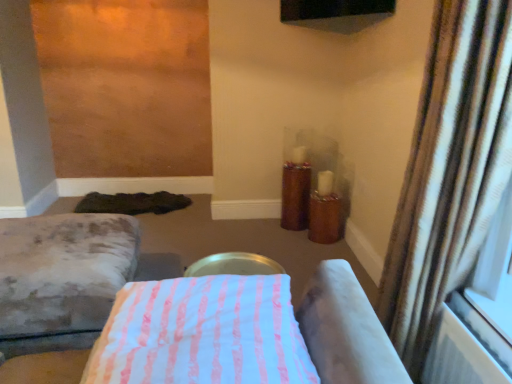
Question: Considering the relative sizes of brown striped curtain at right and pink striped fabric at center, the second furniture when ordered from left to right, in the image provided, is brown striped curtain at right thinner than pink striped fabric at center, the second furniture when ordered from left to right,?

Choices:
 (A) no
 (B) yes

Answer: (B)

Question: Does brown striped curtain at right have a lesser height compared to pink striped fabric at center, the 1th furniture viewed from the front?

Choices:
 (A) no
 (B) yes

Answer: (A)

Question: Is brown striped curtain at right oriented towards pink striped fabric at center, the 1th furniture viewed from the front?

Choices:
 (A) no
 (B) yes

Answer: (A)

Question: Is pink striped fabric at center, which is the first furniture from right to left, at the back of brown striped curtain at right?

Choices:
 (A) no
 (B) yes

Answer: (A)

Question: Does brown striped curtain at right contain pink striped fabric at center, the second furniture when ordered from left to right?

Choices:
 (A) yes
 (B) no

Answer: (B)

Question: From a real-world perspective, is brown striped curtain at right positioned under pink striped fabric at center, the second furniture when ordered from left to right, based on gravity?

Choices:
 (A) yes
 (B) no

Answer: (B)

Question: Could you tell me if wooden candle holder at center-right is facing pink striped fabric at center, the 1th furniture viewed from the front?

Choices:
 (A) no
 (B) yes

Answer: (B)

Question: Considering the relative sizes of wooden candle holder at center-right and pink striped fabric at center, which is the first furniture from right to left, in the image provided, is wooden candle holder at center-right shorter than pink striped fabric at center, which is the first furniture from right to left,?

Choices:
 (A) no
 (B) yes

Answer: (A)

Question: Considering the relative sizes of wooden candle holder at center-right and pink striped fabric at center, the 1th furniture viewed from the front, in the image provided, is wooden candle holder at center-right smaller than pink striped fabric at center, the 1th furniture viewed from the front,?

Choices:
 (A) no
 (B) yes

Answer: (B)

Question: Is wooden candle holder at center-right outside pink striped fabric at center, the 1th furniture viewed from the front?

Choices:
 (A) no
 (B) yes

Answer: (B)

Question: Can you confirm if wooden candle holder at center-right is wider than pink striped fabric at center, the 1th furniture viewed from the front?

Choices:
 (A) yes
 (B) no

Answer: (B)

Question: Considering the relative positions of wooden candle holder at center-right and pink striped fabric at center, the 2th furniture when ordered from back to front, in the image provided, is wooden candle holder at center-right to the right of pink striped fabric at center, the 2th furniture when ordered from back to front, from the viewer's perspective?

Choices:
 (A) yes
 (B) no

Answer: (A)

Question: From the image's perspective, is pink striped fabric at center, which is the first furniture from right to left, under velvet gray ottoman at lower left, marked as the second furniture in a front-to-back arrangement?

Choices:
 (A) yes
 (B) no

Answer: (B)